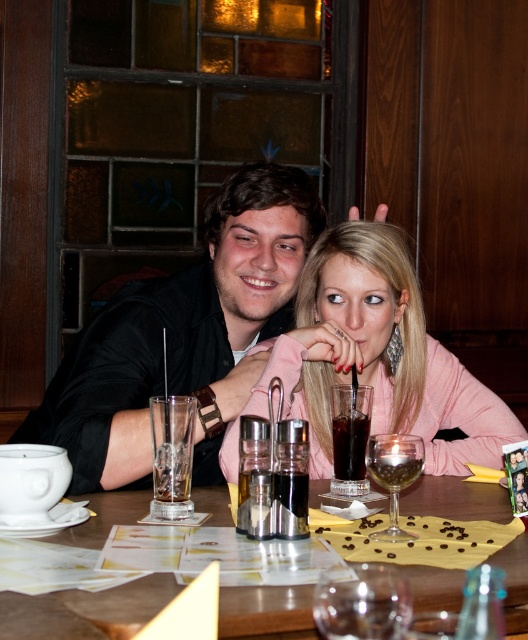
Between translucent glass table at center and transparent glass wine glass at center, which one has more height?

With more height is translucent glass table at center.

Where is `translucent glass table at center`? The width and height of the screenshot is (528, 640). translucent glass table at center is located at coordinates click(86, 611).

From the picture: Who is taller, matte pink sweater at center or translucent glass table at center?

With more height is matte pink sweater at center.

Is point (334, 362) positioned in front of point (462, 484)?

No, (334, 362) is behind (462, 484).

Where is `matte pink sweater at center`? This screenshot has height=640, width=528. matte pink sweater at center is located at coordinates (378, 355).

Can you confirm if matte black shirt at center is positioned to the right of dark brown glass at center?

In fact, matte black shirt at center is to the left of dark brown glass at center.

Who is higher up, matte black shirt at center or dark brown glass at center?

matte black shirt at center is above.

Find the location of a particular element. matte black shirt at center is located at coordinates (183, 336).